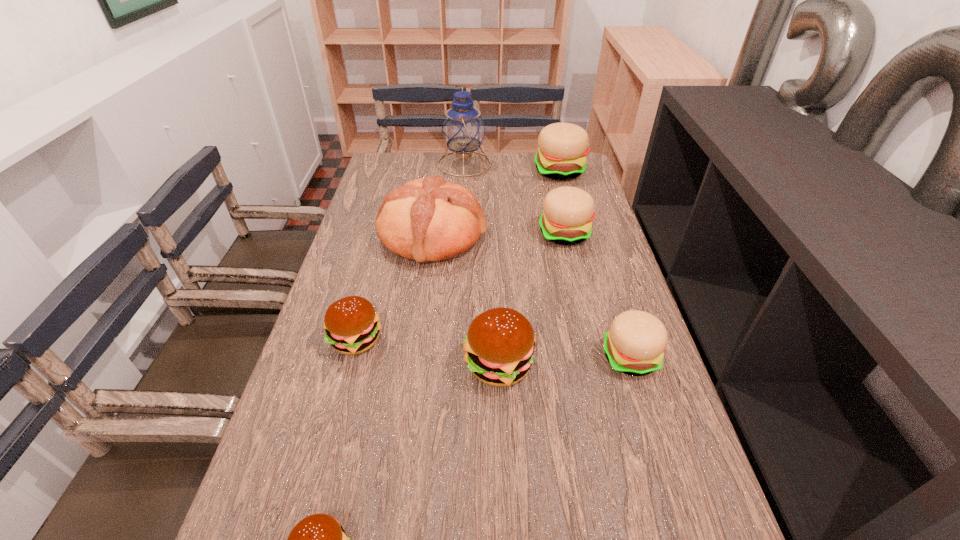
Locate an element on the screen. Image resolution: width=960 pixels, height=540 pixels. bread present at the left edge is located at coordinates (427, 219).

Identify the location of hamburger present at the left edge. This screenshot has width=960, height=540. (351, 324).

The height and width of the screenshot is (540, 960). Identify the location of object at the far right corner. (562, 147).

You are a GUI agent. You are given a task and a screenshot of the screen. Output one action in this format:
    pyautogui.click(x=<x>, y=<y>)
    Task: Click on the free space at the far edge of the desktop
    This screenshot has height=540, width=960.
    Given the screenshot: What is the action you would take?
    pyautogui.click(x=429, y=154)

You are a GUI agent. You are given a task and a screenshot of the screen. Output one action in this format:
    pyautogui.click(x=<x>, y=<y>)
    Task: Click on the vacant space at the left edge of the desktop
    The image size is (960, 540).
    Given the screenshot: What is the action you would take?
    pyautogui.click(x=332, y=281)

Locate an element on the screen. The image size is (960, 540). vacant space at the right edge is located at coordinates (688, 470).

At what (x,y) coordinates should I click in order to perform the action: click on unoccupied position between the second smallest brown hamburger and the biggest brown hamburger. Please return your answer as a coordinate pair (x, y). The width and height of the screenshot is (960, 540). Looking at the image, I should click on (427, 352).

Locate an element on the screen. free space between the second biggest beige hamburger and the bread is located at coordinates (498, 235).

I want to click on free space between the tallest object and the smallest beige hamburger, so click(547, 261).

The width and height of the screenshot is (960, 540). I want to click on free space between the second smallest brown hamburger and the biggest beige hamburger, so click(x=458, y=255).